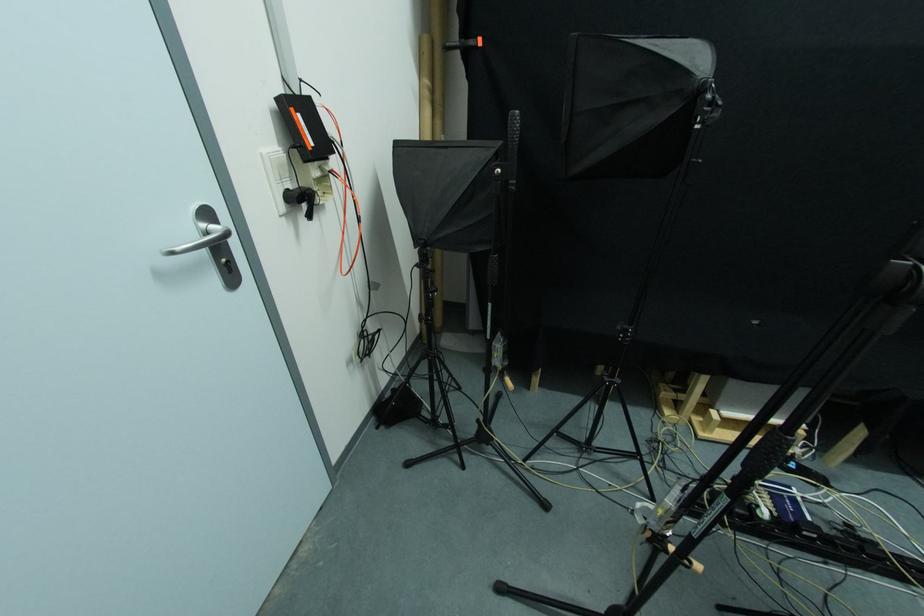
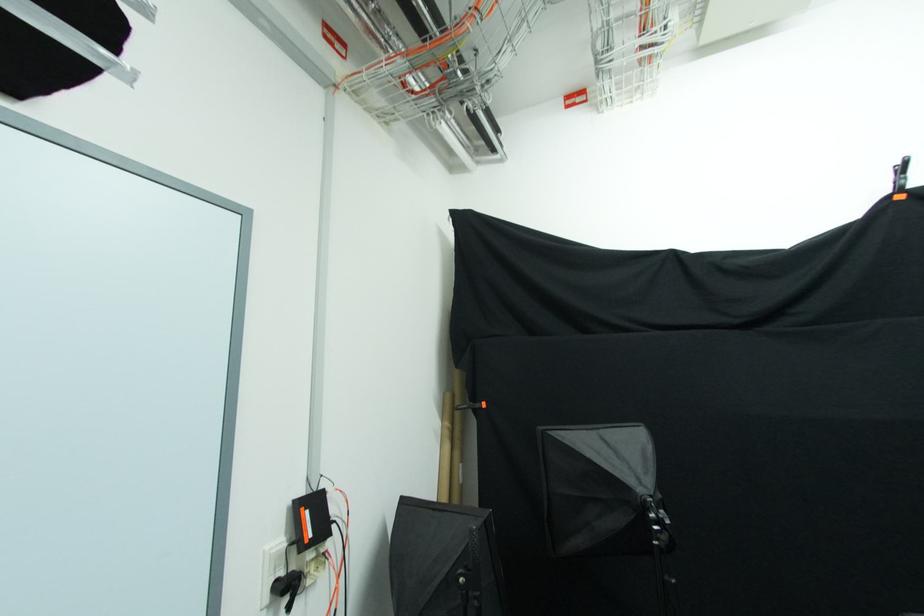
Find the pixel in the second image that matches point (262, 156) in the first image.

(266, 554)